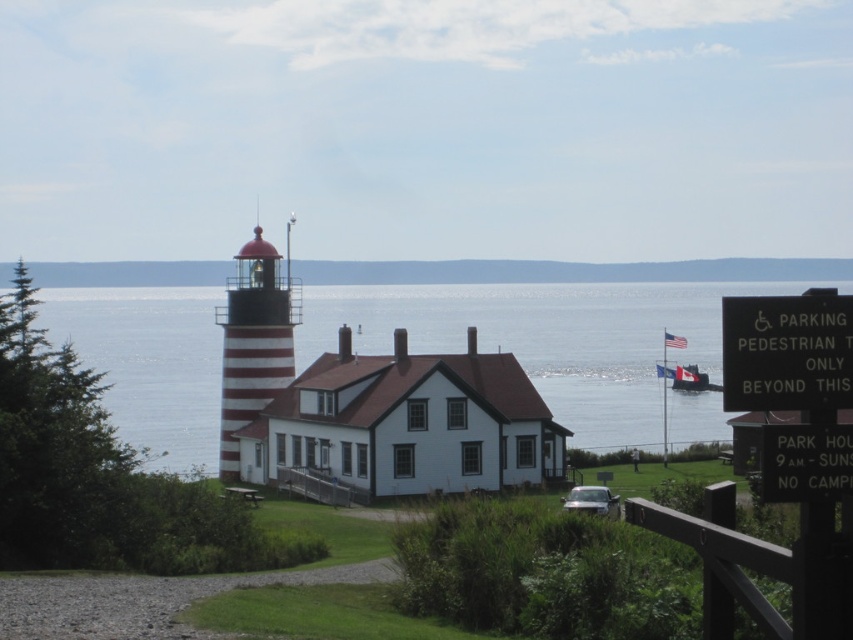
Question: Does black plastic sign at lower right appear over metallic gray boat at center?

Choices:
 (A) yes
 (B) no

Answer: (A)

Question: Considering the relative positions of black plastic sign at right and black plastic sign at lower right in the image provided, where is black plastic sign at right located with respect to black plastic sign at lower right?

Choices:
 (A) left
 (B) right

Answer: (A)

Question: Which point is closer to the camera?

Choices:
 (A) (685, 381)
 (B) (799, 410)
 (C) (825, 483)

Answer: (B)

Question: Which object is positioned farthest from the black plastic sign at right?

Choices:
 (A) black plastic sign at lower right
 (B) blue water at center
 (C) metallic gray boat at center

Answer: (B)

Question: Is black plastic sign at right wider than black plastic sign at lower right?

Choices:
 (A) no
 (B) yes

Answer: (A)

Question: Estimate the real-world distances between objects in this image. Which object is closer to the blue water at center?

Choices:
 (A) metallic gray boat at center
 (B) black plastic sign at lower right

Answer: (A)